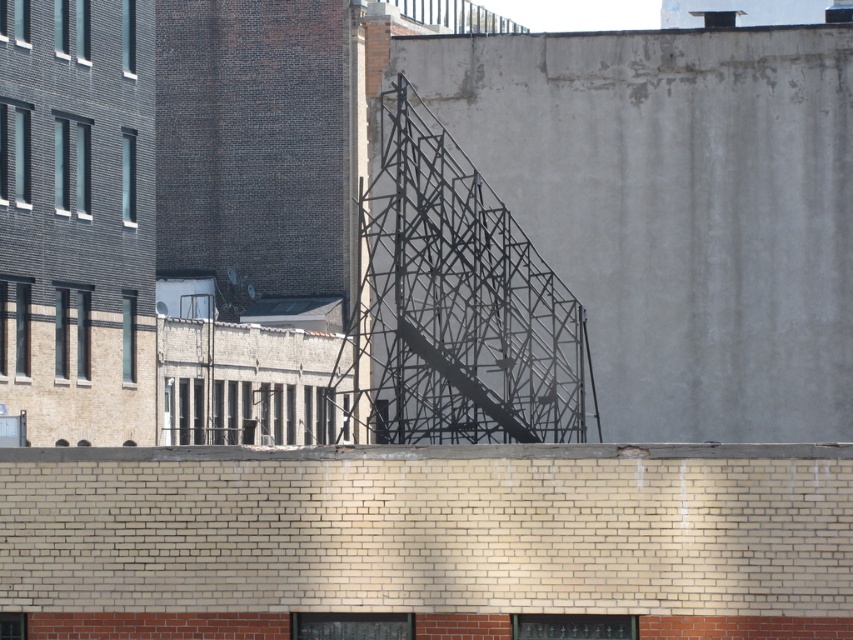
Question: Is metallic scaffolding at center further to camera compared to metallic gray staircase at center?

Choices:
 (A) no
 (B) yes

Answer: (A)

Question: In this image, where is metallic scaffolding at center located relative to metallic gray staircase at center?

Choices:
 (A) above
 (B) below

Answer: (A)

Question: Which point is farther from the camera taking this photo?

Choices:
 (A) (479, 394)
 (B) (422, 240)

Answer: (B)

Question: Does metallic scaffolding at center have a smaller size compared to metallic gray staircase at center?

Choices:
 (A) yes
 (B) no

Answer: (B)